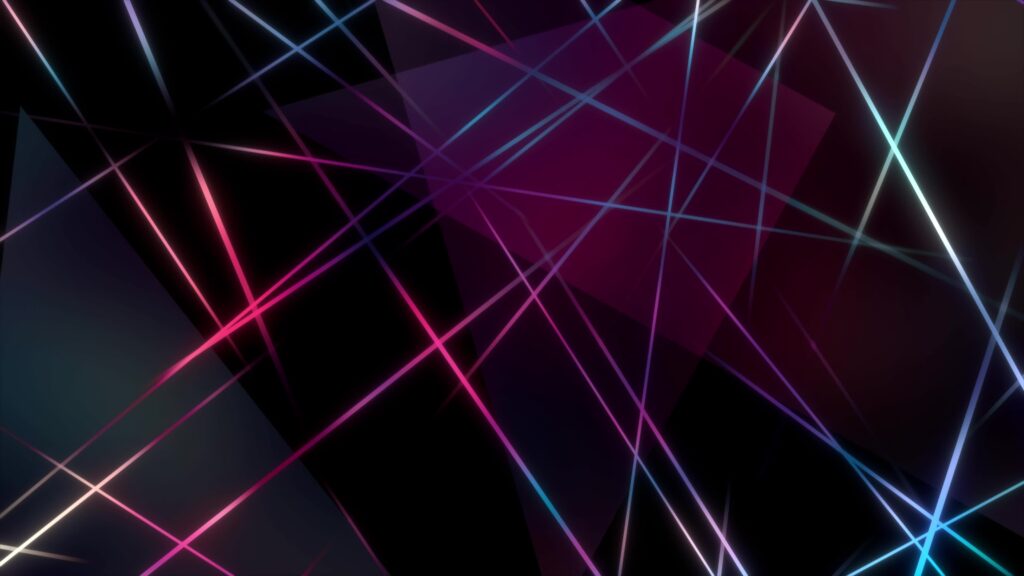
This screenshot has width=1024, height=576. I want to click on light, so click(31, 529).